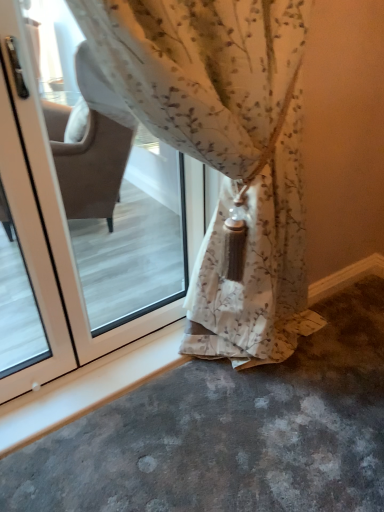
Question: Is floral fabric curtain at center bigger or smaller than white glossy screen door at left?

Choices:
 (A) big
 (B) small

Answer: (A)

Question: Looking at their shapes, would you say floral fabric curtain at center is wider or thinner than white glossy screen door at left?

Choices:
 (A) thin
 (B) wide

Answer: (B)

Question: Would you say floral fabric curtain at center is inside or outside white glossy screen door at left?

Choices:
 (A) outside
 (B) inside

Answer: (A)

Question: Would you say white glossy screen door at left is inside or outside floral fabric curtain at center?

Choices:
 (A) outside
 (B) inside

Answer: (A)

Question: From their relative heights in the image, would you say white glossy screen door at left is taller or shorter than floral fabric curtain at center?

Choices:
 (A) tall
 (B) short

Answer: (B)

Question: Considering the positions of white glossy screen door at left and floral fabric curtain at center in the image, is white glossy screen door at left wider or thinner than floral fabric curtain at center?

Choices:
 (A) wide
 (B) thin

Answer: (B)

Question: Visually, is white glossy screen door at left positioned to the left or to the right of floral fabric curtain at center?

Choices:
 (A) left
 (B) right

Answer: (A)